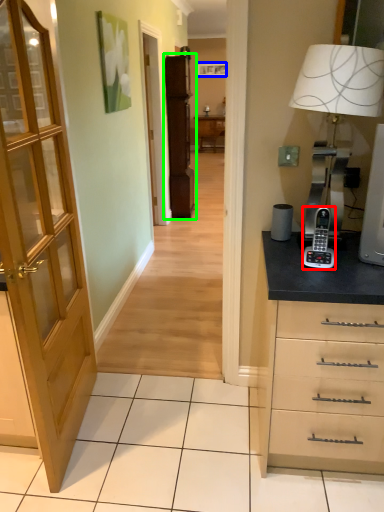
Question: Based on their relative distances, which object is farther from gadget (highlighted by a red box)? Choose from picture frame (highlighted by a blue box) and file cabinet (highlighted by a green box).

Choices:
 (A) picture frame
 (B) file cabinet

Answer: (A)